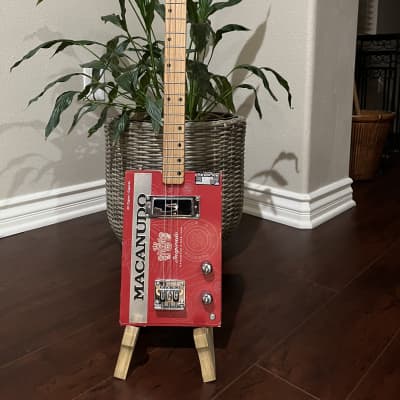
Image resolution: width=400 pixels, height=400 pixels. I want to click on wood floor, so click(32, 284).